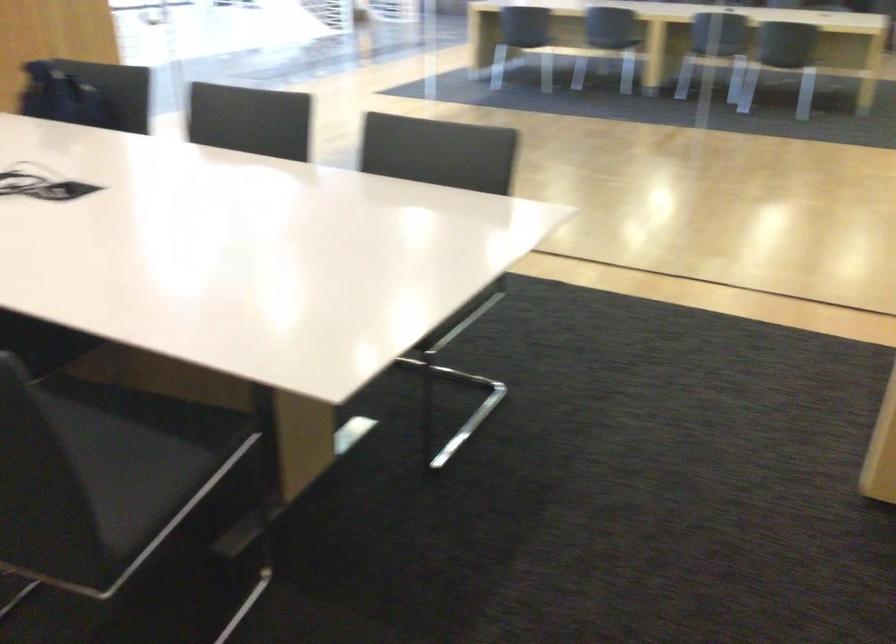
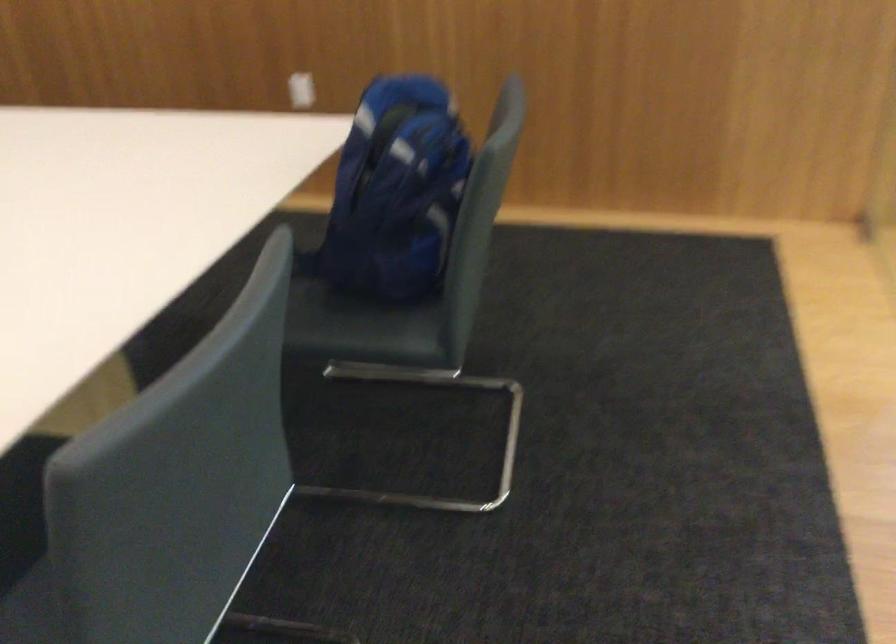
Find the pixel in the second image that matches the point at 89,106 in the first image.

(395, 192)